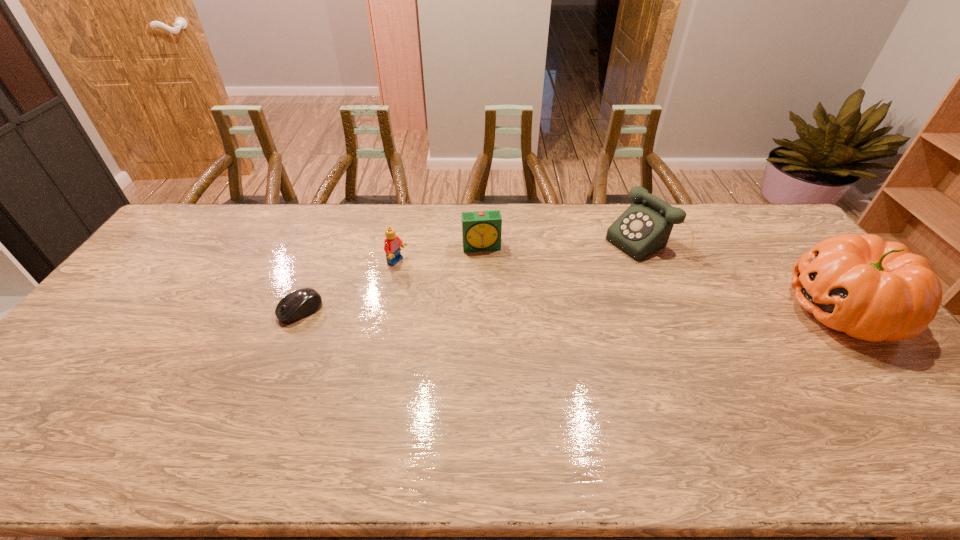
I want to click on vacant space situated on the face of the fourth object from right to left, so 497,307.

Identify the location of alarm clock that is at the far edge. (481, 230).

Where is `telephone located at the far edge`? telephone located at the far edge is located at coordinates (645, 226).

Locate an element on the screen. object located at the right edge is located at coordinates (872, 290).

You are a GUI agent. You are given a task and a screenshot of the screen. Output one action in this format:
    pyautogui.click(x=<x>, y=<y>)
    Task: Click on the vacant region at the far edge of the desktop
    The image size is (960, 540).
    Given the screenshot: What is the action you would take?
    pyautogui.click(x=512, y=242)

The image size is (960, 540). What are the coordinates of `vacant space at the near edge of the desktop` in the screenshot? It's located at (607, 403).

I want to click on vacant space at the left edge, so click(126, 284).

Find the location of `free space at the right edge`. free space at the right edge is located at coordinates coord(786,255).

Where is `blank space at the far left corner`? The height and width of the screenshot is (540, 960). blank space at the far left corner is located at coordinates (232, 203).

At what (x,y) coordinates should I click in order to perform the action: click on empty location between the rightmost object and the shortest object. Please return your answer as a coordinate pair (x, y). Looking at the image, I should click on (572, 310).